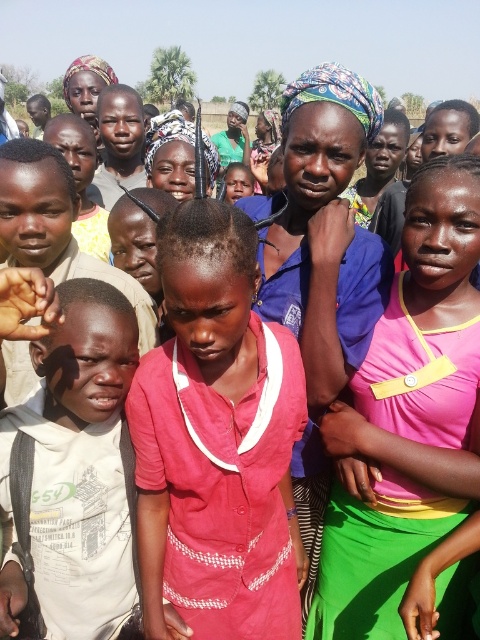
You are organizing a community event and need to seat everyone comfortably. The pink fabric dress at center and the white cotton shirt at left are part of the group. Which clothing item requires more space due to its size?

The pink fabric dress at center requires more space because its width is larger than the white cotton shirt at left.